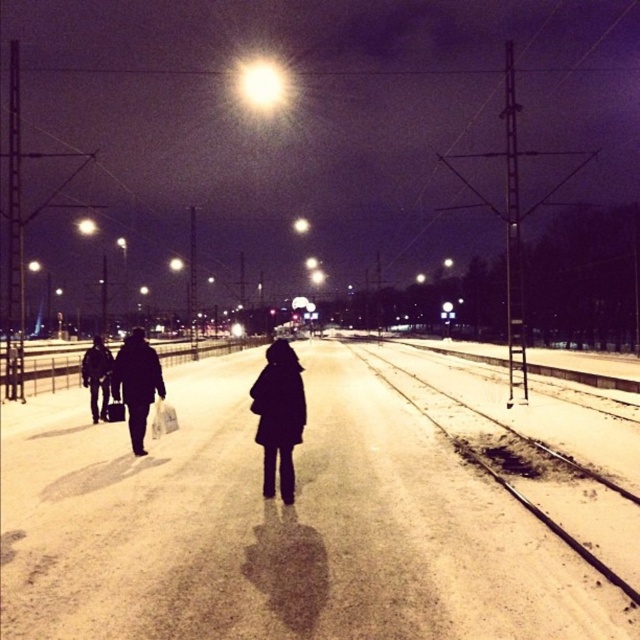
You are a delivery person carrying a 15 feet long ladder. You need to place it on the ground between the smooth concrete train track at center and the black matte coat at center. Is there enough space to lay the ladder horizontally without overlapping either object?

The smooth concrete train track at center and the black matte coat at center are 18.75 feet apart. Since the ladder is 15 feet long, there is sufficient space to lay it horizontally between them without overlapping either object.

You are a photographer standing on the snowy platform. You want to take a photo that includes both the smooth concrete train track at center and the black matte coat at center. Which object should you focus on first to ensure both are in frame?

The smooth concrete train track at center is shorter than the black matte coat at center, so you should focus on the black matte coat at center first to ensure both are in frame.